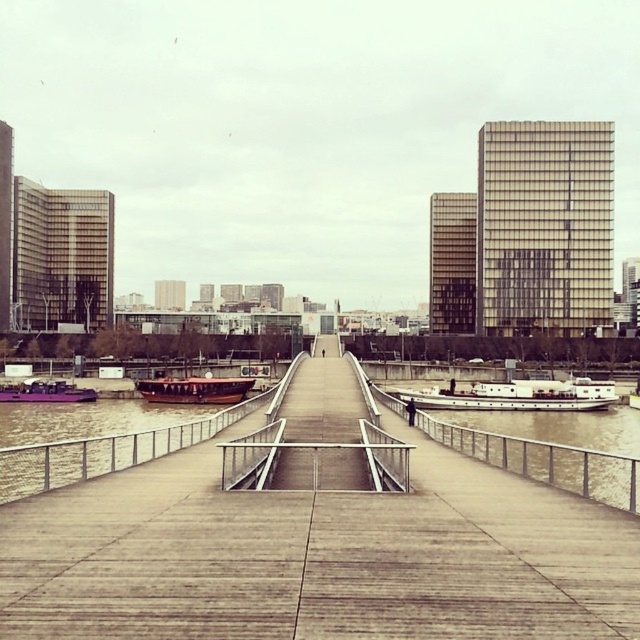
You are standing on the pedestrian bridge and want to reach the point at coordinates point (525, 620). If your walking speed is 3 feet per second, how many seconds will it take you to reach that point?

The point at (525, 620) is 18.13 feet away from the viewer. At a walking speed of 3 feet per second, it will take approximately 6.04 seconds to reach that point.

You are standing on the pedestrian bridge and want to locate the concrete dock at center. According to the coordinates provided, where should you look relative to the bridge?

The concrete dock at center is located at coordinates point (317, 557), which is near the middle section of the bridge. Since the bridge is straight and stretches to a distant point, you should look towards the central area of the bridge to find the concrete dock at center.